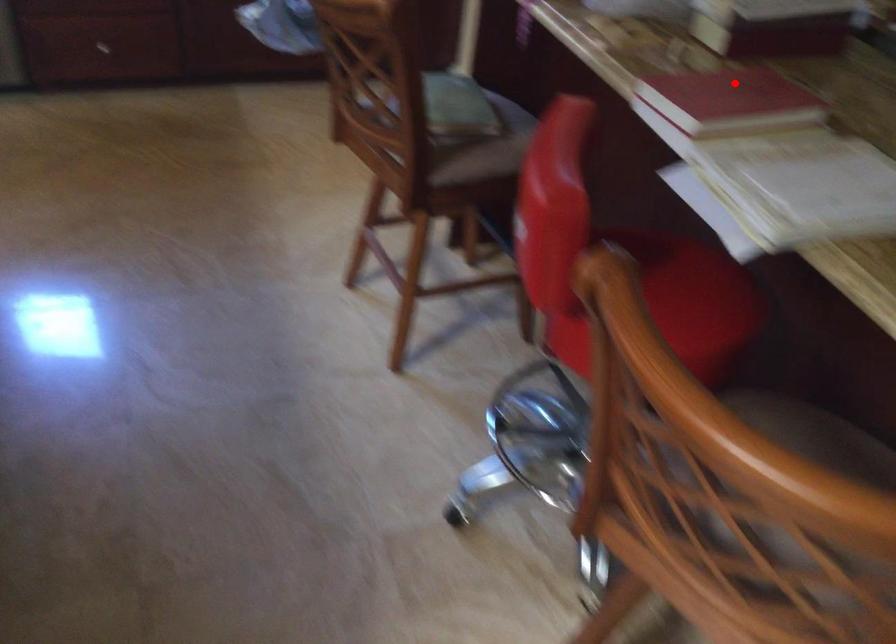
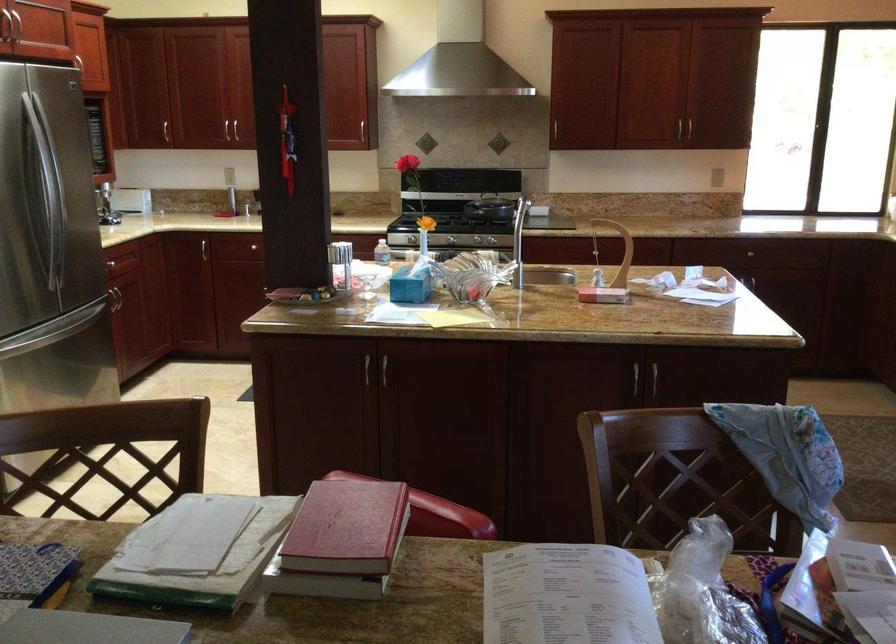
Find the pixel in the second image that matches the highlighted location in the first image.

(346, 527)